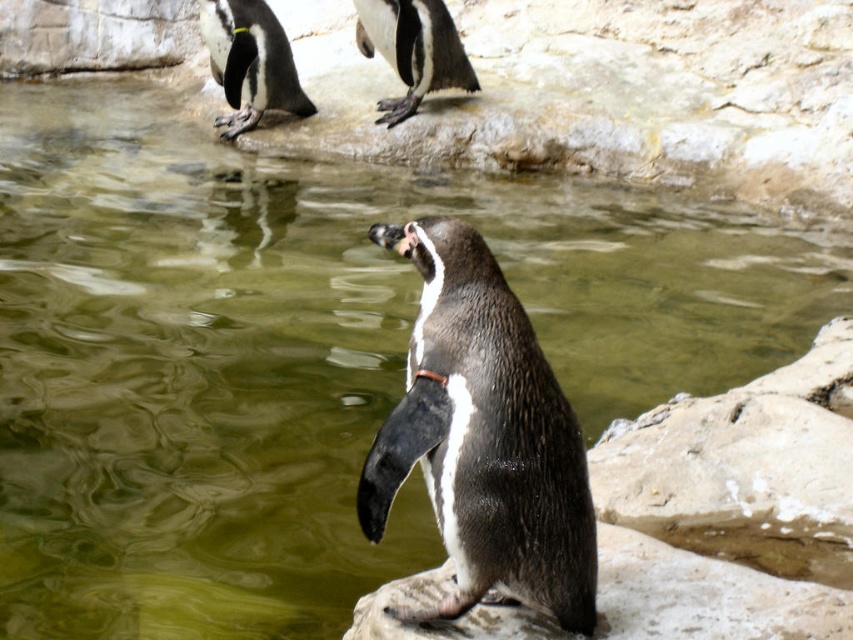
Does point (210, 28) come farther from viewer compared to point (421, 1)?

Yes, it is.

Can you confirm if black glossy penguin at upper left is smaller than black glossy penguin at upper center?

Incorrect, black glossy penguin at upper left is not smaller in size than black glossy penguin at upper center.

This screenshot has width=853, height=640. What are the coordinates of `black glossy penguin at upper left` in the screenshot? It's located at (248, 61).

Does black glossy penguin at center have a greater width compared to black glossy penguin at upper center?

Incorrect, black glossy penguin at center's width does not surpass black glossy penguin at upper center's.

This screenshot has height=640, width=853. In order to click on black glossy penguin at center in this screenshot , I will do pyautogui.click(x=485, y=438).

Image resolution: width=853 pixels, height=640 pixels. I want to click on black glossy penguin at center, so click(x=485, y=438).

Locate an element on the screen. The image size is (853, 640). black glossy penguin at center is located at coordinates [x=485, y=438].

Which of these two, black glossy penguin at center or black glossy penguin at upper left, stands shorter?

black glossy penguin at upper left is shorter.

Locate an element on the screen. The width and height of the screenshot is (853, 640). black glossy penguin at center is located at coordinates (485, 438).